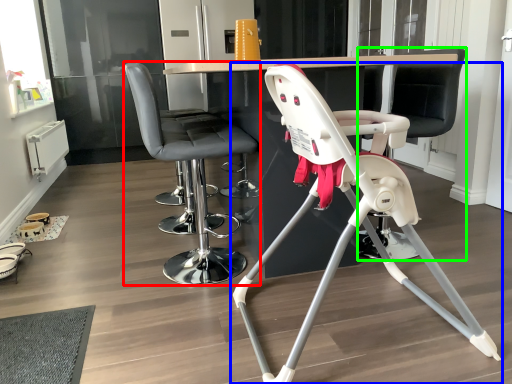
Question: Based on their relative distances, which object is farther from chair (highlighted by a red box)? Choose from chair (highlighted by a blue box) and swivel chair (highlighted by a green box).

Choices:
 (A) chair
 (B) swivel chair

Answer: (B)